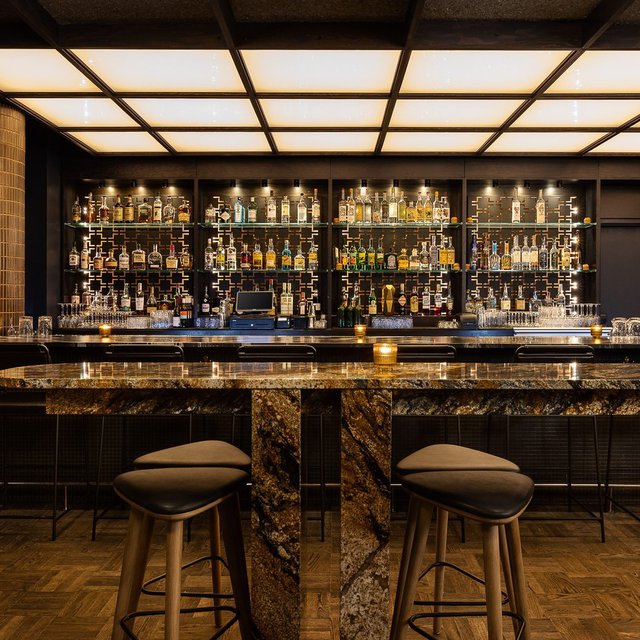
Locate an element on the screen. The width and height of the screenshot is (640, 640). wall tile is located at coordinates (13, 153), (15, 243), (13, 304).